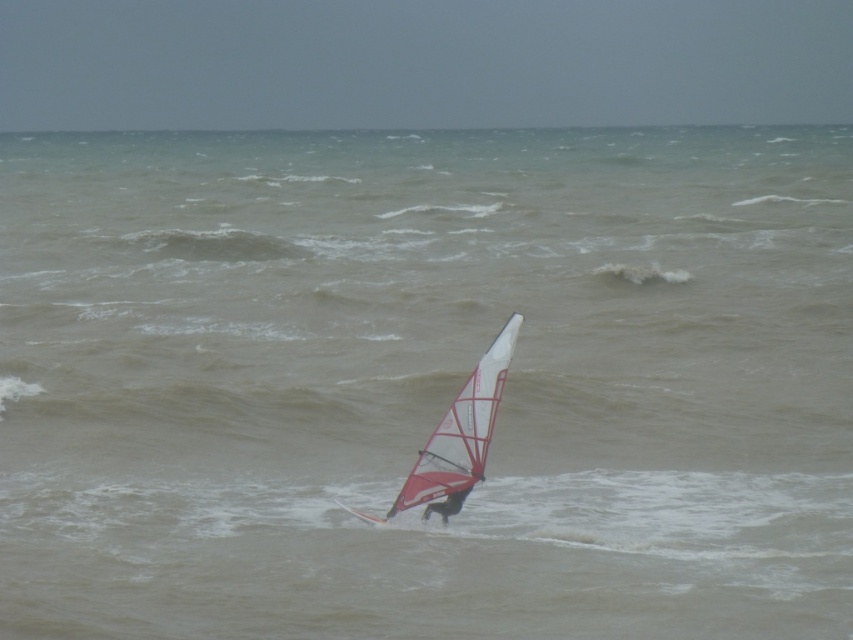
Is white matte sail at center taller than black fabric windsurfer at center?

Correct, white matte sail at center is much taller as black fabric windsurfer at center.

Does white matte sail at center have a smaller size compared to black fabric windsurfer at center?

No, white matte sail at center is not smaller than black fabric windsurfer at center.

This screenshot has width=853, height=640. Find the location of `white matte sail at center`. white matte sail at center is located at coordinates tap(457, 436).